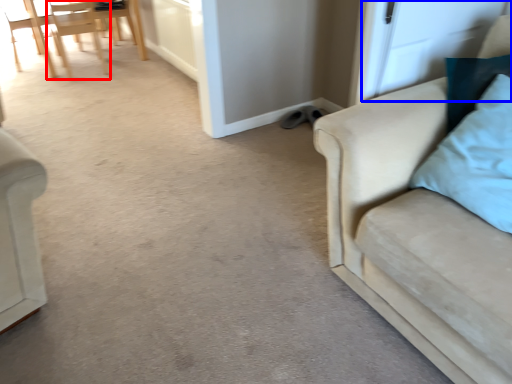
Question: Which object is closer to the camera taking this photo, chair (highlighted by a red box) or screen door (highlighted by a blue box)?

Choices:
 (A) chair
 (B) screen door

Answer: (B)